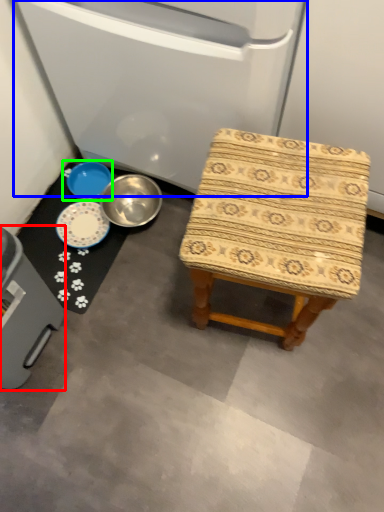
Question: Considering the real-world distances, which object is closest to appliance (highlighted by a red box)? appliance (highlighted by a blue box) or basin (highlighted by a green box).

Choices:
 (A) appliance
 (B) basin

Answer: (B)